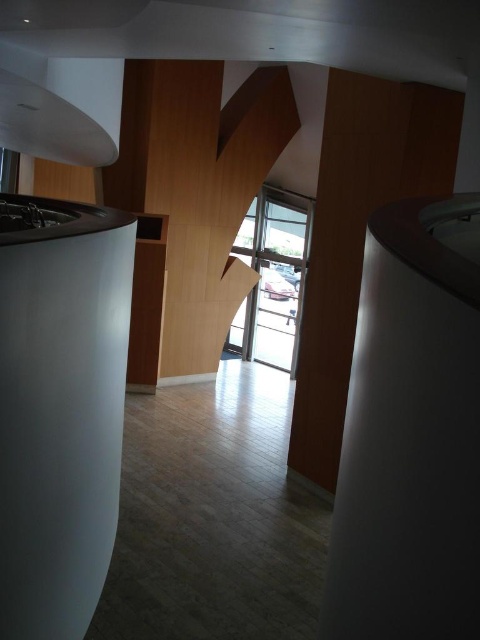
Question: Is white matte pillar at left positioned before transparent glass door at center?

Choices:
 (A) yes
 (B) no

Answer: (A)

Question: Which of the following is the farthest from the observer?

Choices:
 (A) (16, 612)
 (B) (268, 308)

Answer: (B)

Question: Does white matte pillar at left have a greater width compared to transparent glass door at center?

Choices:
 (A) no
 (B) yes

Answer: (A)

Question: Is white matte pillar at left to the left of transparent glass door at center from the viewer's perspective?

Choices:
 (A) no
 (B) yes

Answer: (B)

Question: Which point is closer to the camera taking this photo?

Choices:
 (A) tap(96, 378)
 (B) tap(278, 204)

Answer: (A)

Question: Which point is farther from the camera taking this photo?

Choices:
 (A) (261, 262)
 (B) (52, 257)

Answer: (A)